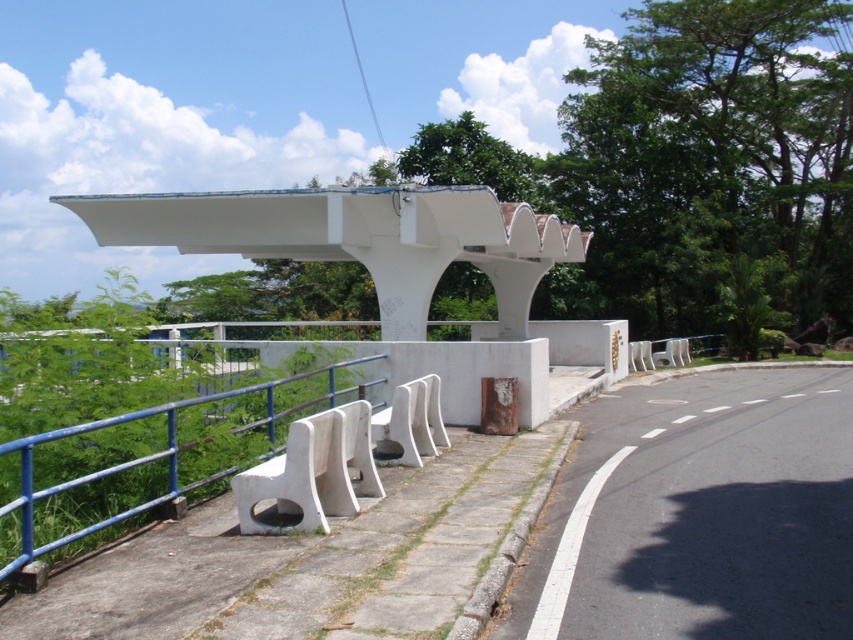
Question: Which of the following is the closest to the observer?

Choices:
 (A) (6, 572)
 (B) (415, 278)

Answer: (A)

Question: Can you confirm if white matte overpass at center is smaller than white plastic rail at lower left?

Choices:
 (A) no
 (B) yes

Answer: (A)

Question: Can you confirm if white matte overpass at center is thinner than white plastic rail at lower left?

Choices:
 (A) yes
 (B) no

Answer: (B)

Question: Is white matte overpass at center closer to the viewer compared to white plastic rail at lower left?

Choices:
 (A) yes
 (B) no

Answer: (B)